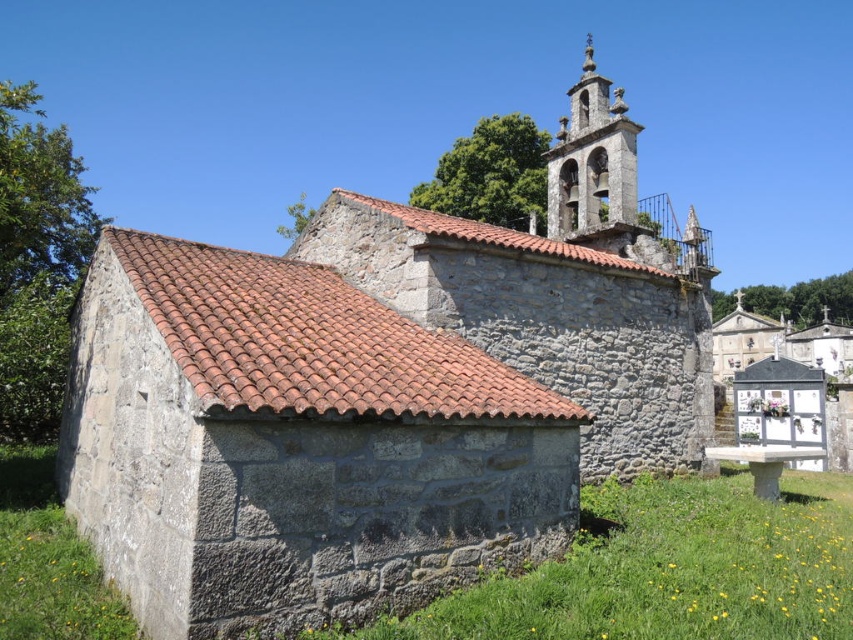
Looking at this image, does rustic stone chapel at center appear on the left side of stone bell tower at upper right?

Correct, you'll find rustic stone chapel at center to the left of stone bell tower at upper right.

Between rustic stone chapel at center and stone bell tower at upper right, which one appears on the left side from the viewer's perspective?

From the viewer's perspective, rustic stone chapel at center appears more on the left side.

Find the location of a particular element. rustic stone chapel at center is located at coordinates (378, 394).

Who is positioned more to the right, brown tile roof at upper left or stone bell tower at upper right?

From the viewer's perspective, stone bell tower at upper right appears more on the right side.

The width and height of the screenshot is (853, 640). What are the coordinates of `brown tile roof at upper left` in the screenshot? It's located at (312, 340).

Image resolution: width=853 pixels, height=640 pixels. Describe the element at coordinates (312, 340) in the screenshot. I see `brown tile roof at upper left` at that location.

Locate an element on the screen. The image size is (853, 640). brown tile roof at upper left is located at coordinates (312, 340).

Who is taller, rustic stone chapel at center or brown tile roof at upper left?

rustic stone chapel at center is taller.

From the picture: Is rustic stone chapel at center shorter than brown tile roof at upper left?

No, rustic stone chapel at center is not shorter than brown tile roof at upper left.

Which is in front, point (490, 364) or point (361, 396)?

Positioned in front is point (361, 396).

Where is `rustic stone chapel at center`? The height and width of the screenshot is (640, 853). rustic stone chapel at center is located at coordinates (378, 394).